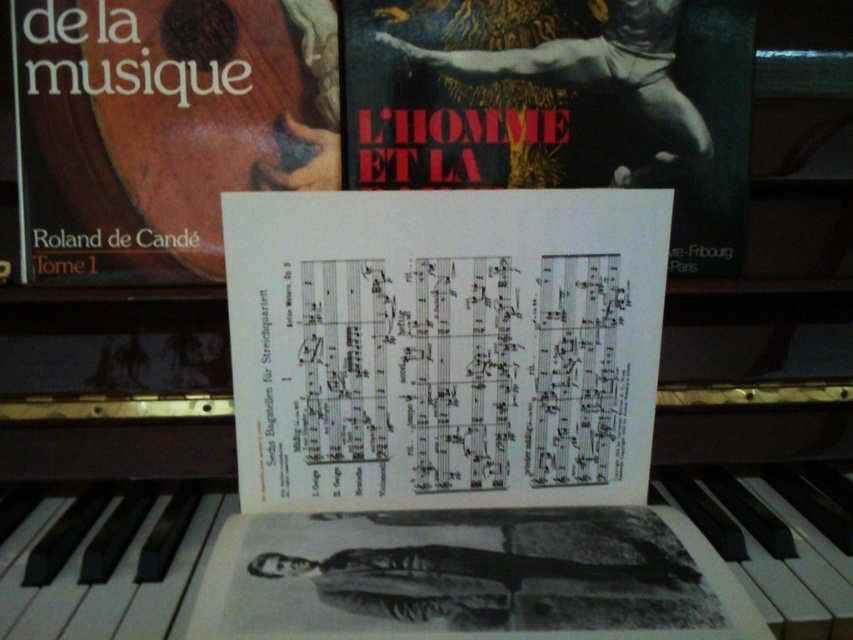
Is white paper music sheet at upper center to the left of matte brown book at center from the viewer's perspective?

In fact, white paper music sheet at upper center is to the right of matte brown book at center.

Is white paper music sheet at upper center shorter than matte brown book at center?

Yes, white paper music sheet at upper center is shorter than matte brown book at center.

Locate an element on the screen. white paper music sheet at upper center is located at coordinates (560, 104).

Who is shorter, white paper music sheet at center or matte brown book at center?

white paper music sheet at center

Does white paper music sheet at center appear on the left side of matte brown book at center?

In fact, white paper music sheet at center is to the right of matte brown book at center.

Who is more distant from viewer, (405, 291) or (138, 97)?

Positioned behind is point (138, 97).

Identify the location of white paper music sheet at center. This screenshot has height=640, width=853. (444, 346).

Between white paper music sheet at center and white paper music sheet at upper center, which one has less height?

white paper music sheet at center

What do you see at coordinates (444, 346) in the screenshot? I see `white paper music sheet at center` at bounding box center [444, 346].

Image resolution: width=853 pixels, height=640 pixels. Identify the location of white paper music sheet at center. (444, 346).